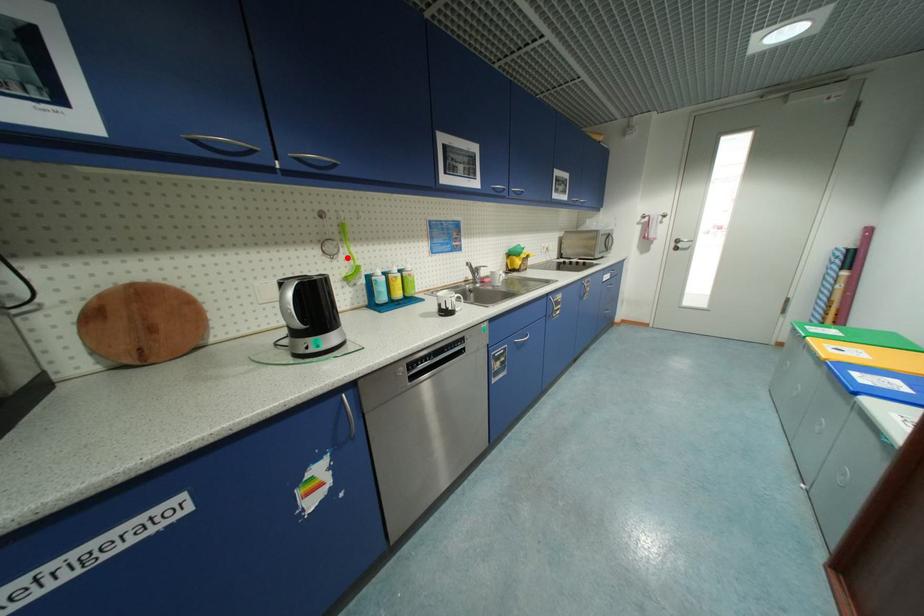
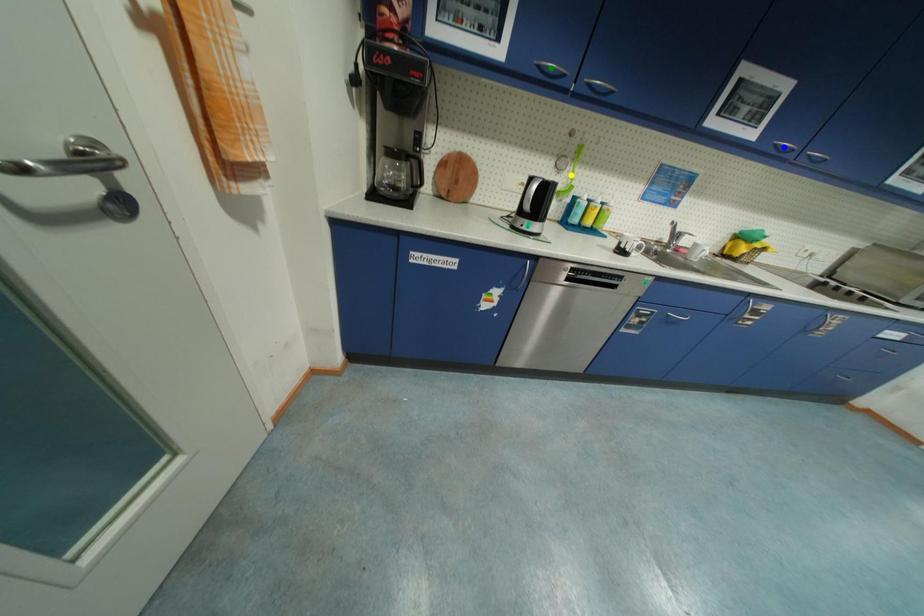
Question: I am providing you with two images of the same scene from different viewpoints. A red point is marked on the first image. You are given multiple points on the second image. Which spot in image 2 lines up with the point in image 1?

Choices:
 (A) yellow point
 (B) blue point
 (C) green point

Answer: (A)